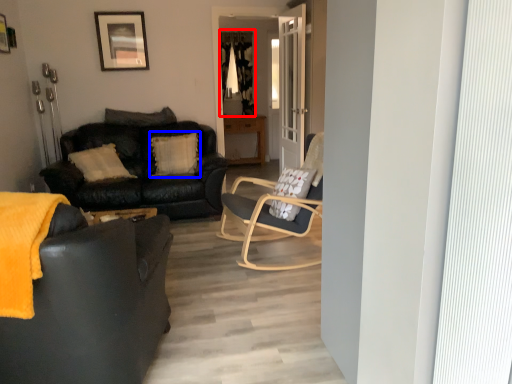
Question: Which object is closer to the camera taking this photo, curtain (highlighted by a red box) or pillow (highlighted by a blue box)?

Choices:
 (A) curtain
 (B) pillow

Answer: (B)